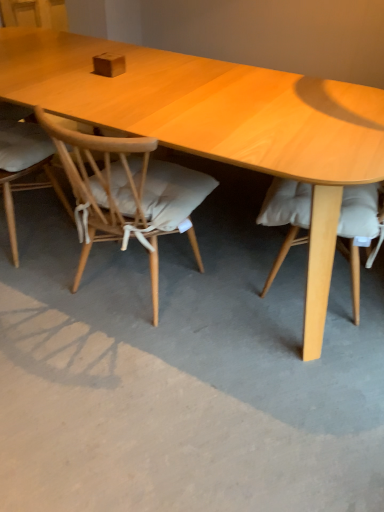
In order to click on free space in front of light wood chair at center, the 1th chair viewed from the right in this screenshot , I will do `click(126, 374)`.